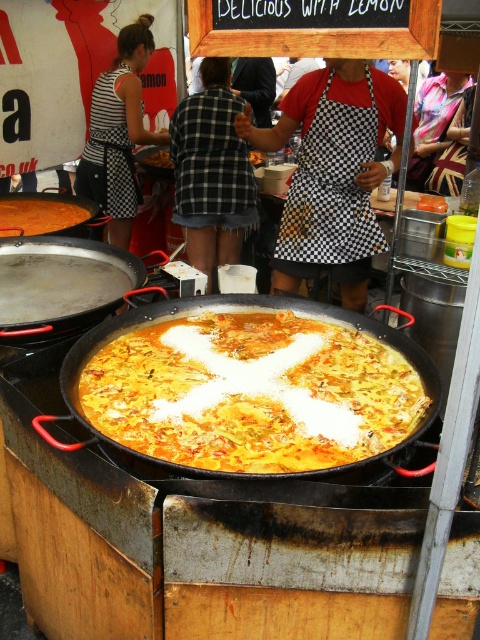
You are a customer at the food stall and want to order the paella. The server asks if you want the dish with extra cheese. You point to the yellowish matte paella at center and the matte black wok at center. Which one shows the dish with cheese on top?

The yellowish matte paella at center has the cheese on top, as it is described as having a generous amount of white cheese or cream, while the matte black wok at center is the cooking vessel itself.

In the scene shown: You are taking a photo of the paella dish at the food stall. You notice two points marked on your camera screen, point (363,289) and point (45,298). Which point is closer to your camera lens?

Point (363,289) is further to the camera than point (45,298), so the point closer to the camera lens is point (45,298).